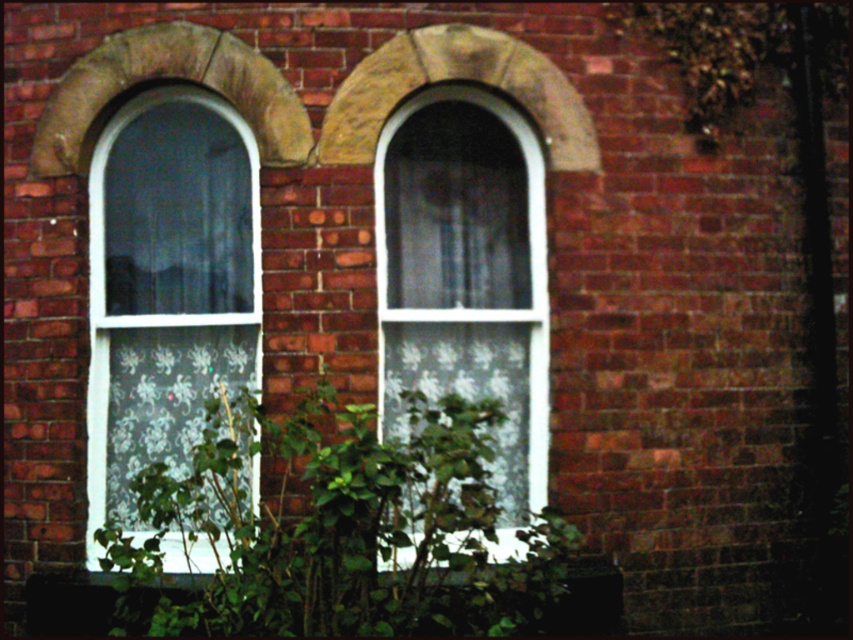
Which is more to the right, white textured glass window at left or white textured glass at center?

white textured glass at center is more to the right.

Which is more to the left, white textured glass window at left or white textured glass at center?

Positioned to the left is white textured glass window at left.

Identify the location of white textured glass window at left. (166, 285).

Locate an element on the screen. Image resolution: width=853 pixels, height=640 pixels. white textured glass window at left is located at coordinates (166, 285).

Is the position of white textured glass window at left less distant than that of green leafy plant at lower center?

No.

Can you confirm if white textured glass window at left is positioned to the right of green leafy plant at lower center?

Yes, white textured glass window at left is to the right of green leafy plant at lower center.

Locate an element on the screen. The image size is (853, 640). white textured glass window at left is located at coordinates (166, 285).

Between green leafy plant at center and white textured glass window at left, which one is positioned higher?

white textured glass window at left is higher up.

Which is in front, point (451, 518) or point (117, 266)?

Point (451, 518) is in front.

Identify the location of green leafy plant at center. Image resolution: width=853 pixels, height=640 pixels. (339, 529).